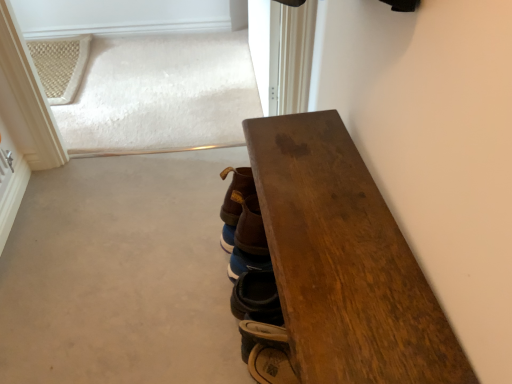
Where is `free point above wooden table at right (from a real-world perspective)`? The width and height of the screenshot is (512, 384). free point above wooden table at right (from a real-world perspective) is located at coordinates 334,233.